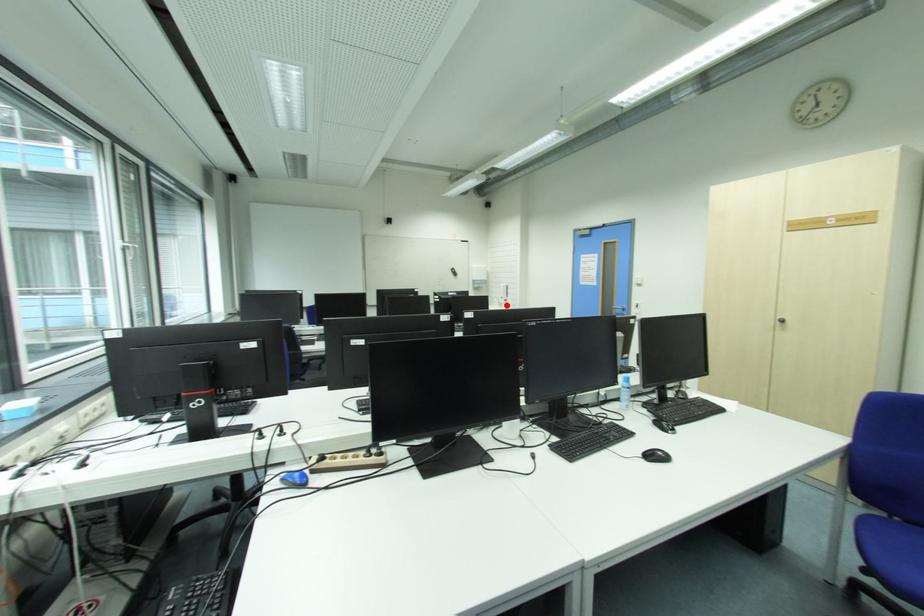
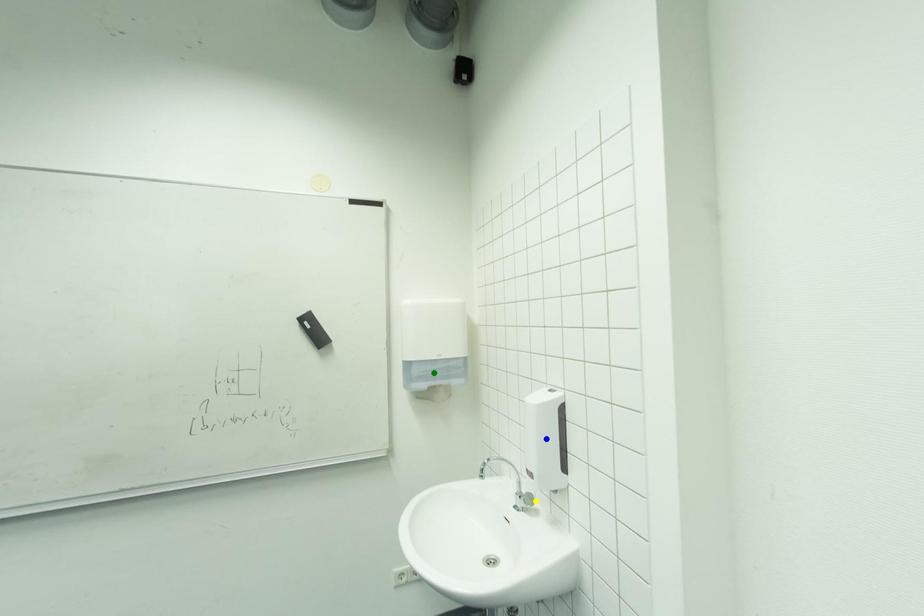
Question: I am providing you with two images of the same scene from different viewpoints. A red point is marked on the first image. You are given multiple points on the second image. Which point in image 2 represents the same 3d spot as the red point in image 1?

Choices:
 (A) green point
 (B) blue point
 (C) yellow point

Answer: (C)